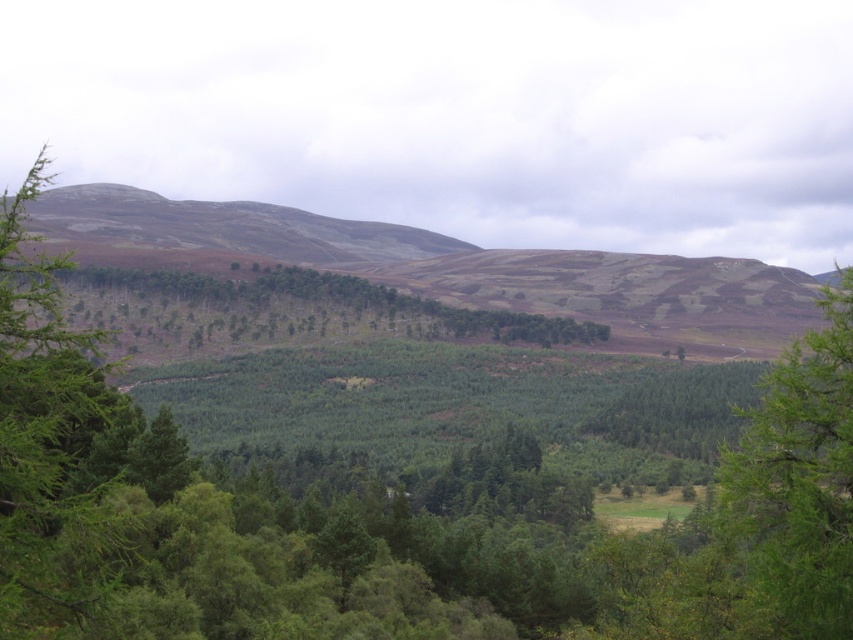
Does green textured trees at center have a larger size compared to earthy brown grassland at upper left?

Actually, green textured trees at center might be smaller than earthy brown grassland at upper left.

Can you confirm if green textured trees at center is thinner than earthy brown grassland at upper left?

Yes.

Between point (183, 284) and point (67, 236), which one is positioned behind?

Point (67, 236)

Image resolution: width=853 pixels, height=640 pixels. Identify the location of green textured trees at center. (270, 308).

Between green leafy tree at right and green textured trees at center, which one appears on the left side from the viewer's perspective?

green textured trees at center is more to the left.

Who is positioned more to the right, green leafy tree at right or green textured trees at center?

Positioned to the right is green leafy tree at right.

This screenshot has width=853, height=640. Describe the element at coordinates (796, 484) in the screenshot. I see `green leafy tree at right` at that location.

You are a GUI agent. You are given a task and a screenshot of the screen. Output one action in this format:
    pyautogui.click(x=<x>, y=<y>)
    Task: Click on the green leafy tree at right
    
    Given the screenshot: What is the action you would take?
    pyautogui.click(x=796, y=484)

Does green matte tree at left have a larger size compared to earthy brown grassland at upper left?

No, green matte tree at left is not bigger than earthy brown grassland at upper left.

Is point (94, 396) positioned after point (351, 220)?

No, it is in front of (351, 220).

Identify the location of green matte tree at left. This screenshot has height=640, width=853. click(x=53, y=444).